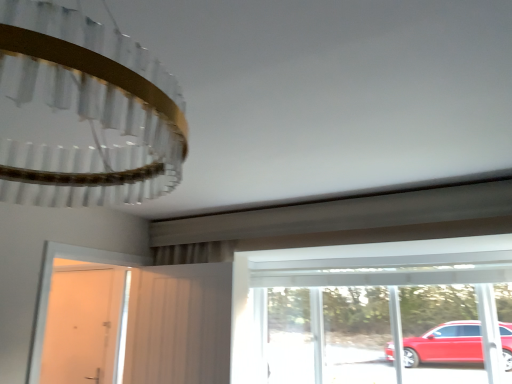
The image size is (512, 384). What are the coordinates of `white matte door at left, the 1th door when ordered from right to left` in the screenshot? It's located at (130, 320).

Image resolution: width=512 pixels, height=384 pixels. What do you see at coordinates (179, 324) in the screenshot? I see `white fabric screen door at center` at bounding box center [179, 324].

The width and height of the screenshot is (512, 384). In order to click on transparent glass window at center in this screenshot , I will do `click(374, 312)`.

Is point (79, 378) farther from viewer compared to point (127, 376)?

Yes, it is.

Who is smaller, white matte door at left, arranged as the first door when viewed from the front, or white fabric screen door at center?

white fabric screen door at center is smaller.

Looking at this image, which is more to the right, white matte door at left, the 1th door when ordered from right to left, or white fabric screen door at center?

From the viewer's perspective, white fabric screen door at center appears more on the right side.

Measure the distance from white matte door at left, placed as the 2th door when sorted from left to right, to white fabric screen door at center.

white matte door at left, placed as the 2th door when sorted from left to right, and white fabric screen door at center are 5.75 centimeters apart from each other.

Does transparent glass window at center come in front of white matte door at left, the 1th door when ordered from right to left?

No, transparent glass window at center is behind white matte door at left, the 1th door when ordered from right to left.

From a real-world perspective, does transparent glass window at center sit lower than white matte door at left, the 1th door when ordered from right to left?

Yes, from a real-world perspective, transparent glass window at center is under white matte door at left, the 1th door when ordered from right to left.

Looking at the image, does transparent glass window at center seem bigger or smaller compared to white matte door at left, the 1th door when ordered from right to left?

In the image, transparent glass window at center appears to be larger than white matte door at left, the 1th door when ordered from right to left.

Can you confirm if transparent glass window at center is taller than white matte door at left, placed as the 2th door when sorted from left to right?

Yes, transparent glass window at center is taller than white matte door at left, placed as the 2th door when sorted from left to right.

Which object is thinner, white glossy door at left, acting as the 1th door starting from the back, or white matte door at left, placed as the 2th door when sorted from left to right?

With smaller width is white glossy door at left, acting as the 1th door starting from the back.

Is white glossy door at left, marked as the 1th door in a left-to-right arrangement, inside or outside of white matte door at left, arranged as the first door when viewed from the front?

white glossy door at left, marked as the 1th door in a left-to-right arrangement, is outside white matte door at left, arranged as the first door when viewed from the front.

Considering the positions of objects white glossy door at left, which is the 2th door in right-to-left order, and white matte door at left, arranged as the first door when viewed from the front, in the image provided, who is in front, white glossy door at left, which is the 2th door in right-to-left order, or white matte door at left, arranged as the first door when viewed from the front,?

white matte door at left, arranged as the first door when viewed from the front, is in front.

Can you tell me how much white glossy door at left, marked as the 1th door in a left-to-right arrangement, and white matte door at left, arranged as the first door when viewed from the front, differ in facing direction?

89.3 degrees separate the facing orientations of white glossy door at left, marked as the 1th door in a left-to-right arrangement, and white matte door at left, arranged as the first door when viewed from the front.

Can you confirm if white matte door at left, the 1th door when ordered from right to left, is positioned to the right of transparent glass window at center?

No.

From the image's perspective, is white matte door at left, placed as the 2th door when sorted from left to right, on top of transparent glass window at center?

Yes, from the image's perspective, white matte door at left, placed as the 2th door when sorted from left to right, is on top of transparent glass window at center.

Does point (113, 320) come in front of point (256, 380)?

No.

From a real-world perspective, between white matte door at left, the 1th door when ordered from right to left, and transparent glass window at center, who is vertically lower?

transparent glass window at center, from a real-world perspective.

Based on their sizes in the image, would you say white glossy door at left, marked as the 1th door in a left-to-right arrangement, is bigger or smaller than white fabric screen door at center?

Clearly, white glossy door at left, marked as the 1th door in a left-to-right arrangement, is smaller in size than white fabric screen door at center.

From the image's perspective, between white glossy door at left, positioned as the second door in front-to-back order, and white fabric screen door at center, who is located below?

From the image's view, white glossy door at left, positioned as the second door in front-to-back order, is below.

Can you tell me how much white glossy door at left, acting as the 1th door starting from the back, and white fabric screen door at center differ in facing direction?

The angular difference between white glossy door at left, acting as the 1th door starting from the back, and white fabric screen door at center is 1.72 degrees.

Does white fabric screen door at center turn towards white glossy door at left, which is the 2th door in right-to-left order?

No.

Measure the distance from white fabric screen door at center to white glossy door at left, which is the 2th door in right-to-left order.

The distance of white fabric screen door at center from white glossy door at left, which is the 2th door in right-to-left order, is 1.17 meters.

Is white fabric screen door at center located outside white glossy door at left, which is the 2th door in right-to-left order?

white fabric screen door at center is positioned outside white glossy door at left, which is the 2th door in right-to-left order.

Which of these two, white fabric screen door at center or white glossy door at left, positioned as the second door in front-to-back order, is smaller?

white glossy door at left, positioned as the second door in front-to-back order.

From the image's perspective, is transparent glass window at center positioned above or below white glossy door at left, marked as the 1th door in a left-to-right arrangement?

From the image's perspective, transparent glass window at center appears above white glossy door at left, marked as the 1th door in a left-to-right arrangement.

Is transparent glass window at center aimed at white glossy door at left, marked as the 1th door in a left-to-right arrangement?

No, transparent glass window at center does not turn towards white glossy door at left, marked as the 1th door in a left-to-right arrangement.

Looking at this image, considering the sizes of transparent glass window at center and white glossy door at left, positioned as the second door in front-to-back order, in the image, is transparent glass window at center bigger or smaller than white glossy door at left, positioned as the second door in front-to-back order,?

transparent glass window at center is bigger than white glossy door at left, positioned as the second door in front-to-back order.

Locate an element on the screen. This screenshot has height=384, width=512. screen door that is behind the white matte door at left, placed as the 2th door when sorted from left to right is located at coordinates (179, 324).

I want to click on door above the transparent glass window at center (from the image's perspective), so click(130, 320).

Considering their positions, is white matte door at left, the second door from the back, positioned closer to white glossy door at left, marked as the 1th door in a left-to-right arrangement, than transparent glass window at center?

white matte door at left, the second door from the back, lies closer to white glossy door at left, marked as the 1th door in a left-to-right arrangement, than the other object.

Consider the image. When comparing their distances from white matte door at left, the 1th door when ordered from right to left, does transparent glass window at center or white glossy door at left, acting as the 1th door starting from the back, seem closer?

white glossy door at left, acting as the 1th door starting from the back.

Which object lies further to the anchor point white matte door at left, placed as the 2th door when sorted from left to right, transparent glass window at center or white fabric screen door at center?

Based on the image, transparent glass window at center appears to be further to white matte door at left, placed as the 2th door when sorted from left to right.

Estimate the real-world distances between objects in this image. Which object is further from white fabric screen door at center, transparent glass window at center or white matte door at left, placed as the 2th door when sorted from left to right?

transparent glass window at center lies further to white fabric screen door at center than the other object.

Considering their positions, is white glossy door at left, marked as the 1th door in a left-to-right arrangement, positioned closer to white matte door at left, arranged as the first door when viewed from the front, than white fabric screen door at center?

Among the two, white fabric screen door at center is located nearer to white matte door at left, arranged as the first door when viewed from the front.

When comparing their distances from white fabric screen door at center, does white matte door at left, the second door from the back, or transparent glass window at center seem closer?

white matte door at left, the second door from the back.

Which object lies further to the anchor point white fabric screen door at center, white glossy door at left, positioned as the second door in front-to-back order, or white matte door at left, the second door from the back?

Based on the image, white glossy door at left, positioned as the second door in front-to-back order, appears to be further to white fabric screen door at center.

Looking at the image, which one is located further to white glossy door at left, acting as the 1th door starting from the back, white fabric screen door at center or transparent glass window at center?

transparent glass window at center is further to white glossy door at left, acting as the 1th door starting from the back.

Where is `screen door between white glossy door at left, acting as the 1th door starting from the back, and transparent glass window at center, in the horizontal direction`? screen door between white glossy door at left, acting as the 1th door starting from the back, and transparent glass window at center, in the horizontal direction is located at coordinates (179, 324).

The width and height of the screenshot is (512, 384). I want to click on screen door between white matte door at left, arranged as the first door when viewed from the front, and transparent glass window at center, so click(179, 324).

Find the location of a particular element. screen door positioned between white matte door at left, the 1th door when ordered from right to left, and white glossy door at left, positioned as the second door in front-to-back order, from near to far is located at coordinates (179, 324).

Find the location of a particular element. Image resolution: width=512 pixels, height=384 pixels. door between white glossy door at left, acting as the 1th door starting from the back, and transparent glass window at center from left to right is located at coordinates [x=130, y=320].